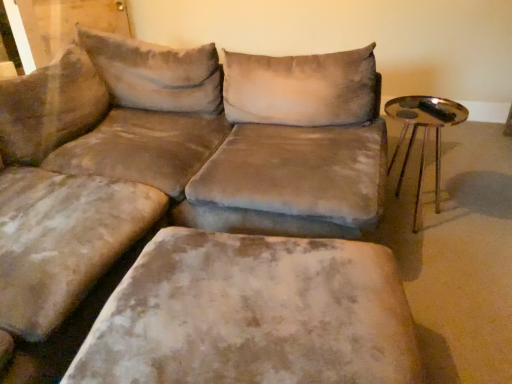
In order to click on free space above velvet beige ottoman at lower center (from a real-world perspective) in this screenshot , I will do `click(257, 311)`.